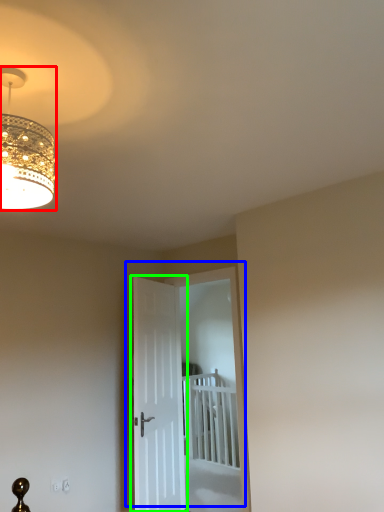
Question: Which is nearer to the lamp (highlighted by a red box)? door (highlighted by a blue box) or door (highlighted by a green box).

Choices:
 (A) door
 (B) door

Answer: (B)